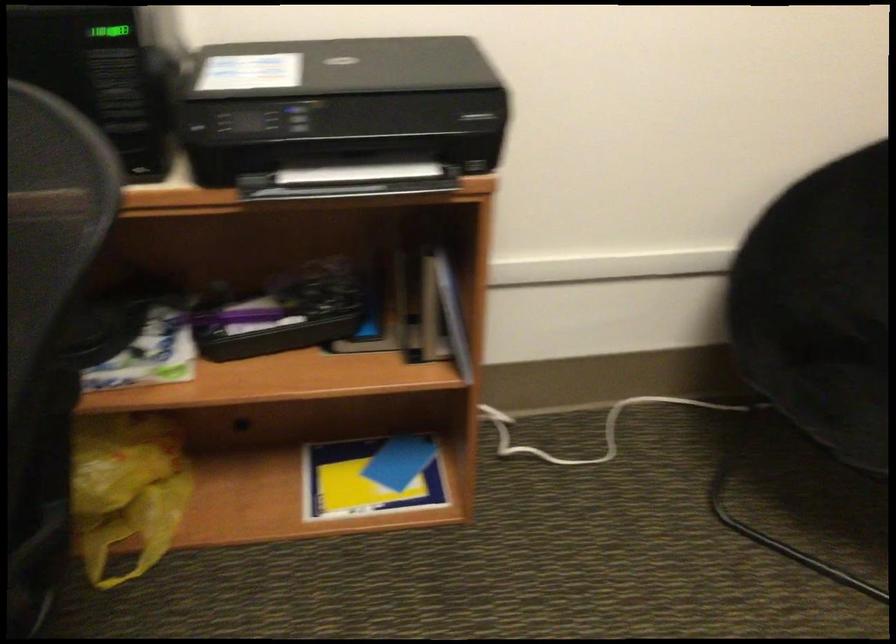
The width and height of the screenshot is (896, 644). What do you see at coordinates (247, 120) in the screenshot?
I see `the printer control buttons` at bounding box center [247, 120].